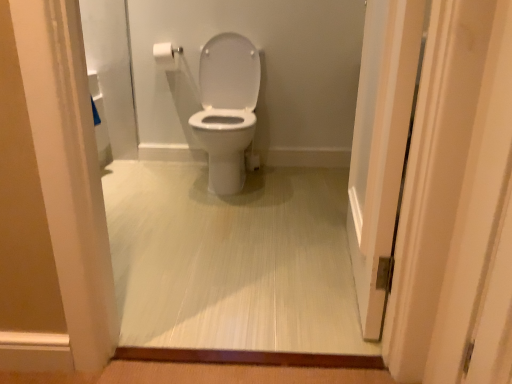
Question: Considering the relative sizes of white glossy toilet at center and white matte toilet paper at upper left in the image provided, is white glossy toilet at center bigger than white matte toilet paper at upper left?

Choices:
 (A) no
 (B) yes

Answer: (B)

Question: From the image's perspective, is white glossy toilet at center on top of white matte toilet paper at upper left?

Choices:
 (A) no
 (B) yes

Answer: (A)

Question: From a real-world perspective, does white glossy toilet at center sit lower than white matte toilet paper at upper left?

Choices:
 (A) no
 (B) yes

Answer: (B)

Question: Is white glossy toilet at center far away from white matte toilet paper at upper left?

Choices:
 (A) yes
 (B) no

Answer: (A)

Question: Does white glossy toilet at center lie in front of white matte toilet paper at upper left?

Choices:
 (A) yes
 (B) no

Answer: (A)

Question: Could you tell me if white glossy toilet at center is facing white matte toilet paper at upper left?

Choices:
 (A) yes
 (B) no

Answer: (B)

Question: Is white matte toilet paper at upper left oriented away from white glossy door at right?

Choices:
 (A) yes
 (B) no

Answer: (B)

Question: From a real-world perspective, is white matte toilet paper at upper left physically above white glossy door at right?

Choices:
 (A) yes
 (B) no

Answer: (A)

Question: Is white matte toilet paper at upper left smaller than white glossy door at right?

Choices:
 (A) yes
 (B) no

Answer: (A)

Question: Is white matte toilet paper at upper left behind white glossy door at right?

Choices:
 (A) yes
 (B) no

Answer: (A)

Question: Are white matte toilet paper at upper left and white glossy door at right making contact?

Choices:
 (A) yes
 (B) no

Answer: (B)

Question: Is white matte toilet paper at upper left to the right of white glossy door at right from the viewer's perspective?

Choices:
 (A) no
 (B) yes

Answer: (A)

Question: Does white glossy toilet at center come in front of white glossy door at right?

Choices:
 (A) no
 (B) yes

Answer: (A)